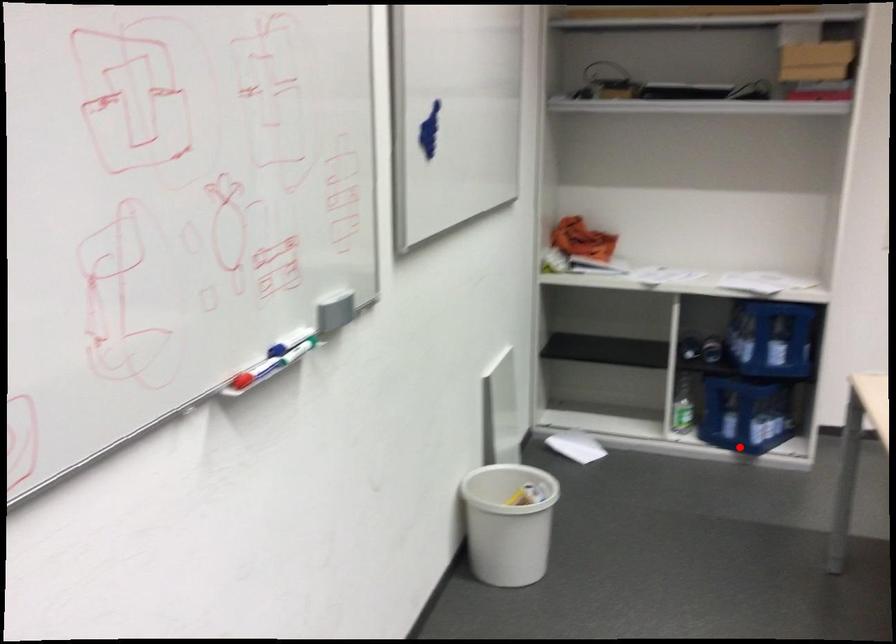
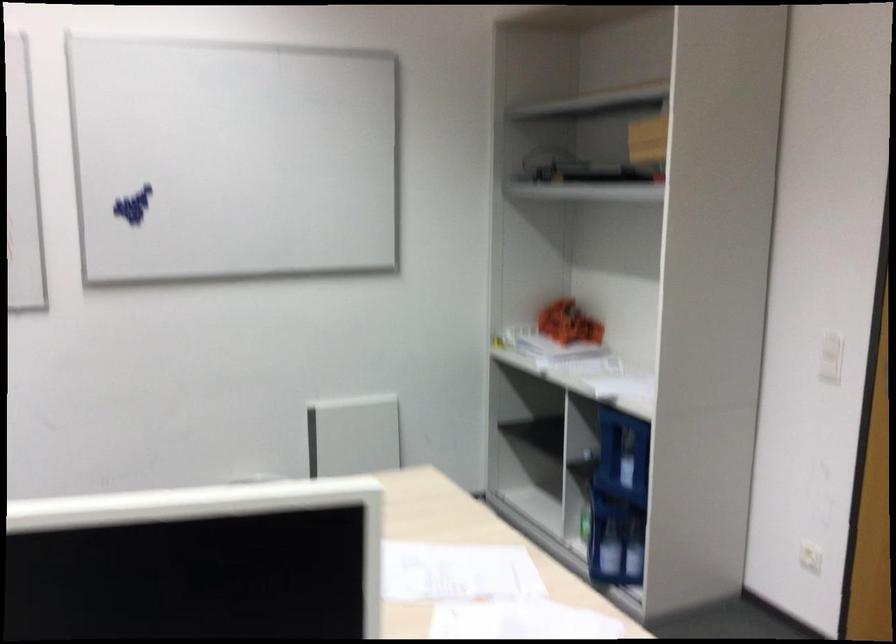
Find the pixel in the second image that matches the highlighted location in the first image.

(613, 550)